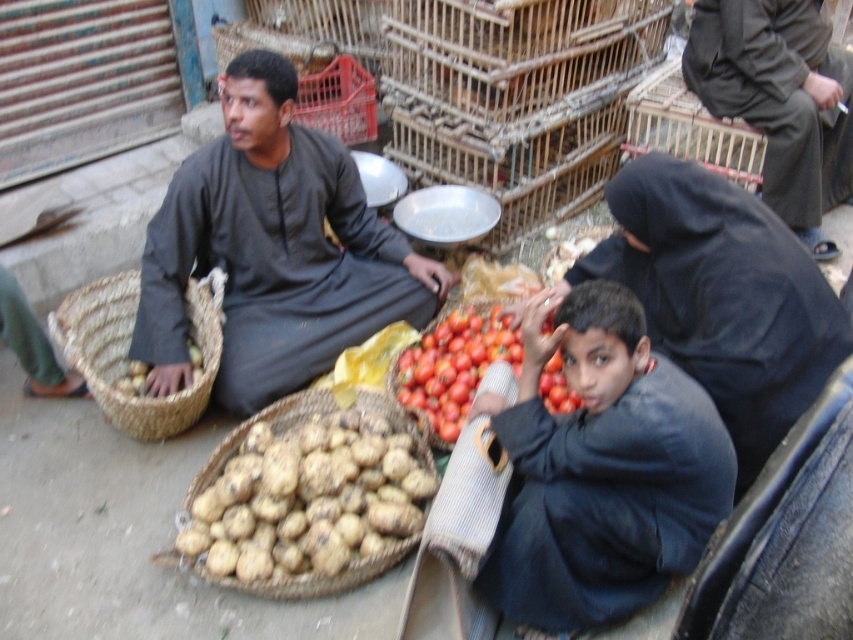
Does dark gray fabric man at center appear under brown woven basket at lower left?

Incorrect, dark gray fabric man at center is not positioned below brown woven basket at lower left.

Can you confirm if dark gray fabric man at center is bigger than brown woven basket at lower left?

Yes, dark gray fabric man at center is bigger than brown woven basket at lower left.

Locate an element on the screen. dark gray fabric man at center is located at coordinates (273, 250).

This screenshot has height=640, width=853. In order to click on dark gray fabric man at center in this screenshot , I will do `click(273, 250)`.

Does black matte robe at lower right lie in front of natural woven basket at center?

That is True.

Between point (753, 323) and point (258, 28), which one is positioned behind?

Point (258, 28)

Image resolution: width=853 pixels, height=640 pixels. I want to click on black matte robe at lower right, so click(722, 296).

Is dark blue fabric at lower right closer to camera compared to ripe red tomato at center?

Yes.

Where is `dark blue fabric at lower right`? The image size is (853, 640). dark blue fabric at lower right is located at coordinates (601, 468).